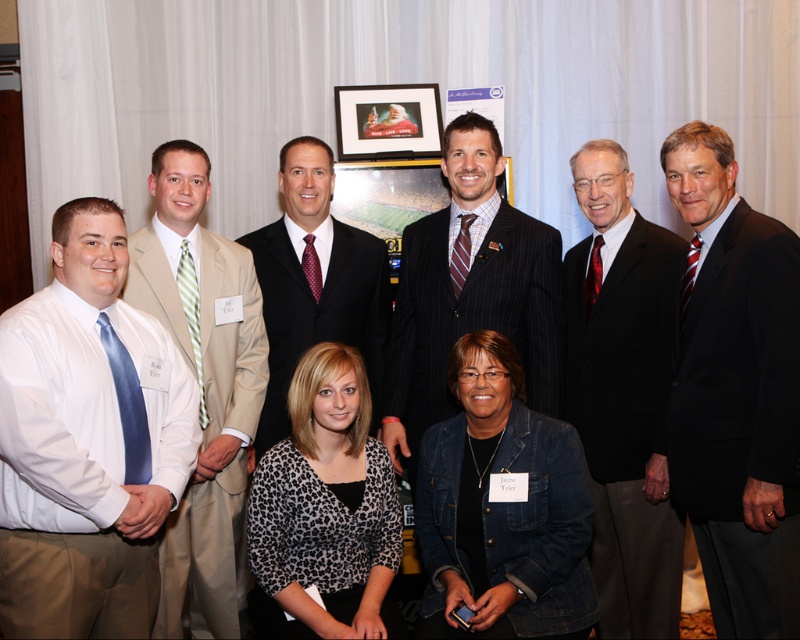
Question: Is black pinstripe suit at right thinner than leopard print blouse at center?

Choices:
 (A) yes
 (B) no

Answer: (A)

Question: Which point is farther to the camera?

Choices:
 (A) (525, 339)
 (B) (598, 458)
 (C) (100, 282)
 (D) (737, 422)

Answer: (A)

Question: Which point is closer to the camera?

Choices:
 (A) white satin shirt at left
 (B) dark blue suit at center
 (C) denim jacket at lower right
 (D) striped tie at center

Answer: (A)

Question: Based on their relative distances, which object is nearer to the denim jacket at lower right?

Choices:
 (A) beige suit at left
 (B) black pinstripe suit at right
 (C) dark blue suit at center

Answer: (B)

Question: Is black pinstripe suit at right thinner than denim jacket at lower right?

Choices:
 (A) yes
 (B) no

Answer: (A)

Question: Does white satin shirt at left have a smaller size compared to striped tie at center?

Choices:
 (A) no
 (B) yes

Answer: (A)